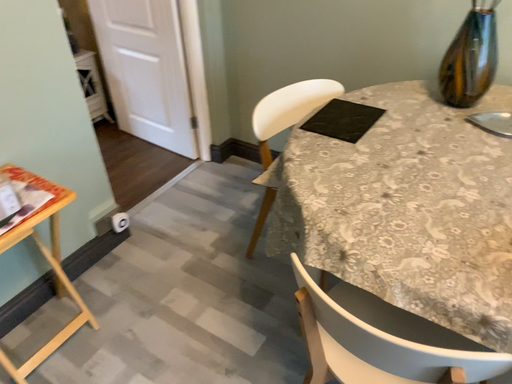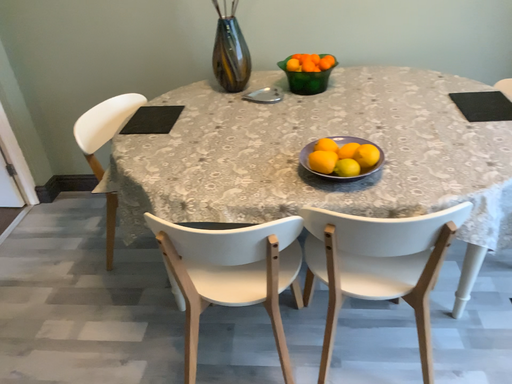
Question: Which way did the camera rotate in the video?

Choices:
 (A) rotated left
 (B) rotated right

Answer: (B)